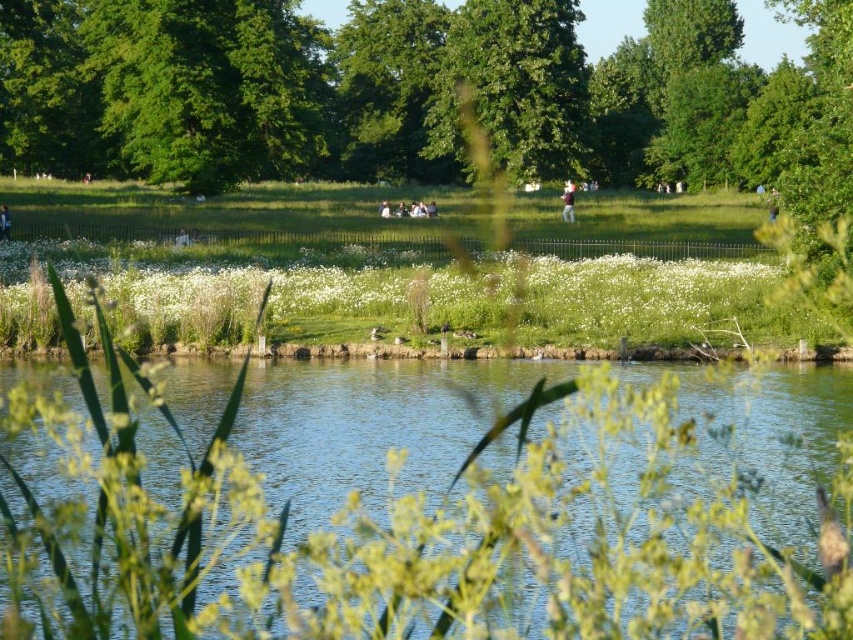
You are standing in the park and want to take a photo of the green leafy tree at center and the light brown wooden stick at lower left. Which object will appear bigger in your photo?

The green leafy tree at center will appear bigger in the photo because it has a larger size compared to the light brown wooden stick at lower left.